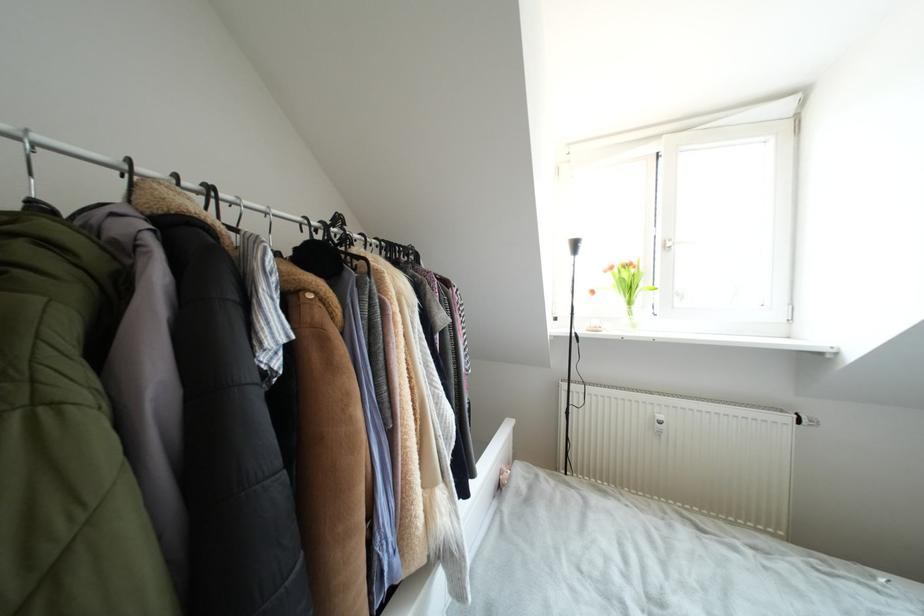
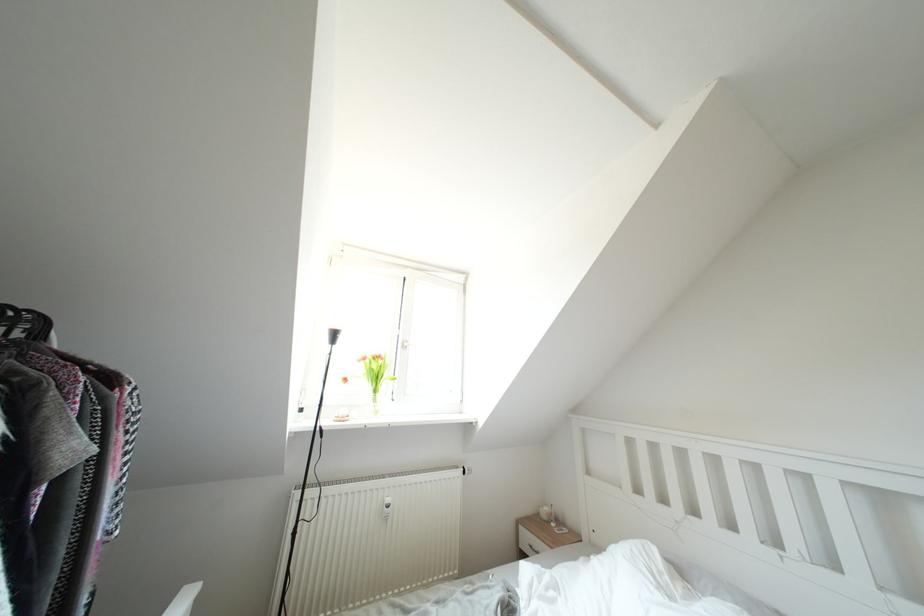
The point at (616,272) is marked in the first image. Where is the corresponding point in the second image?

(370, 363)